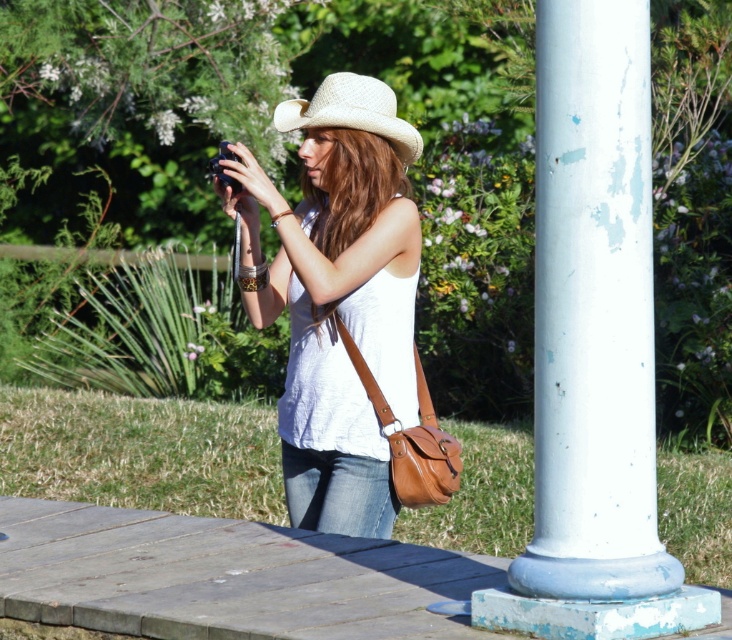
Question: Observing the image, what is the correct spatial positioning of white painted metal pole at right in reference to denim jeans at lower center?

Choices:
 (A) below
 (B) above

Answer: (B)

Question: Among these points, which one is farthest from the camera?

Choices:
 (A) (392, 449)
 (B) (305, 480)
 (C) (313, 129)

Answer: (B)

Question: Which point is closer to the camera?

Choices:
 (A) brown leather shoulder bag at center
 (B) denim jeans at lower center

Answer: (A)

Question: Does brown leather shoulder bag at center have a lesser width compared to woven straw cowboy hat at center?

Choices:
 (A) no
 (B) yes

Answer: (A)

Question: Observing the image, what is the correct spatial positioning of white painted metal pole at right in reference to woven straw cowboy hat at center?

Choices:
 (A) below
 (B) above

Answer: (A)

Question: Which point is closer to the camera?

Choices:
 (A) white matte tank top at center
 (B) white painted metal pole at right
 (C) denim jeans at lower center
 (D) woven straw cowboy hat at center

Answer: (B)